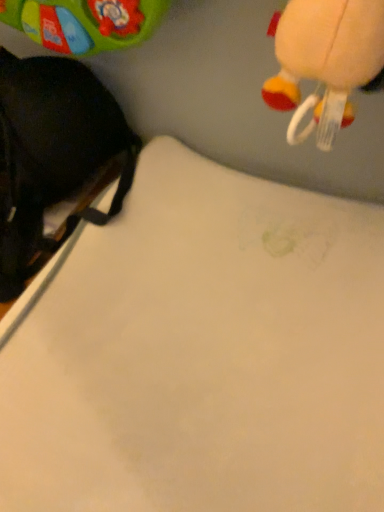
You are a GUI agent. You are given a task and a screenshot of the screen. Output one action in this format:
    pyautogui.click(x=<x>, y=<y>)
    Task: Click on the black fabric backpack at left
    This screenshot has width=384, height=512.
    Given the screenshot: What is the action you would take?
    pyautogui.click(x=53, y=155)

Describe the element at coordinates (53, 155) in the screenshot. The width and height of the screenshot is (384, 512). I see `black fabric backpack at left` at that location.

Describe the element at coordinates (203, 353) in the screenshot. I see `white matte sheet at center` at that location.

In order to face white matte sheet at center, should I rotate leftwards or rightwards?

Turn right by 3.915 degrees to look at white matte sheet at center.

Image resolution: width=384 pixels, height=512 pixels. Identify the location of white matte sheet at center. (203, 353).

What is the approximate width of white matte sheet at center?

white matte sheet at center is 20.27 inches in width.

Identify the location of black fabric backpack at left. Image resolution: width=384 pixels, height=512 pixels. (53, 155).

In the image, is black fabric backpack at left on the left side or the right side of white matte sheet at center?

black fabric backpack at left is to the left of white matte sheet at center.

Is the depth of black fabric backpack at left greater than that of white matte sheet at center?

Yes, black fabric backpack at left is further from the viewer.

Is point (42, 125) positioned in front of point (28, 344)?

That is False.

Looking at this image, from the image's perspective, is black fabric backpack at left under white matte sheet at center?

No.

From a real-world perspective, is black fabric backpack at left physically above white matte sheet at center?

Yes, from a real-world perspective, black fabric backpack at left is over white matte sheet at center

Considering the sizes of objects black fabric backpack at left and white matte sheet at center in the image provided, who is thinner, black fabric backpack at left or white matte sheet at center?

black fabric backpack at left is thinner.

Is black fabric backpack at left shorter than white matte sheet at center?

In fact, black fabric backpack at left may be taller than white matte sheet at center.

Looking at this image, who is bigger, black fabric backpack at left or white matte sheet at center?

white matte sheet at center.

Is black fabric backpack at left inside or outside of white matte sheet at center?

black fabric backpack at left is not inside white matte sheet at center, it's outside.

Is black fabric backpack at left next to white matte sheet at center and touching it?

No, black fabric backpack at left is not making contact with white matte sheet at center.

Is white matte sheet at center at the back of black fabric backpack at left?

No.

What's the angular difference between black fabric backpack at left and white matte sheet at center's facing directions?

The angle between the facing direction of black fabric backpack at left and the facing direction of white matte sheet at center is 3.06 degrees.

How much distance is there between black fabric backpack at left and white matte sheet at center?

black fabric backpack at left and white matte sheet at center are 7.21 inches apart from each other.

I want to click on toy lying behind the white matte sheet at center, so click(53, 155).

Considering the positions of objects white matte sheet at center and black fabric backpack at left in the image provided, who is more to the right, white matte sheet at center or black fabric backpack at left?

white matte sheet at center is more to the right.

Which object is closer to the camera taking this photo, white matte sheet at center or black fabric backpack at left?

white matte sheet at center is more forward.

Between point (207, 275) and point (25, 197), which one is positioned in front?

The point (207, 275) is closer to the camera.

From the image's perspective, which is below, white matte sheet at center or black fabric backpack at left?

white matte sheet at center.

Based on the photo, from a real-world perspective, is white matte sheet at center above or below black fabric backpack at left?

white matte sheet at center is below black fabric backpack at left.

Which of these two, white matte sheet at center or black fabric backpack at left, is thinner?

black fabric backpack at left.

From the picture: Between white matte sheet at center and black fabric backpack at left, which one has less height?

Standing shorter between the two is white matte sheet at center.

Considering the relative sizes of white matte sheet at center and black fabric backpack at left in the image provided, is white matte sheet at center bigger than black fabric backpack at left?

Correct, white matte sheet at center is larger in size than black fabric backpack at left.

Is white matte sheet at center situated inside black fabric backpack at left or outside?

white matte sheet at center cannot be found inside black fabric backpack at left.

Is white matte sheet at center far from black fabric backpack at left?

That's not correct — white matte sheet at center is a little close to black fabric backpack at left.

Is white matte sheet at center aimed at black fabric backpack at left?

No, white matte sheet at center is not facing towards black fabric backpack at left.

How different are the orientations of white matte sheet at center and black fabric backpack at left in degrees?

The angle between the facing direction of white matte sheet at center and the facing direction of black fabric backpack at left is 3.06 degrees.

How distant is white matte sheet at center from black fabric backpack at left?

A distance of 7.21 inches exists between white matte sheet at center and black fabric backpack at left.

Identify the location of toy located on the left of white matte sheet at center. (53, 155).

This screenshot has height=512, width=384. I want to click on toy above the white matte sheet at center (from the image's perspective), so click(x=53, y=155).

Identify the location of sheet in front of the black fabric backpack at left. This screenshot has height=512, width=384. (203, 353).